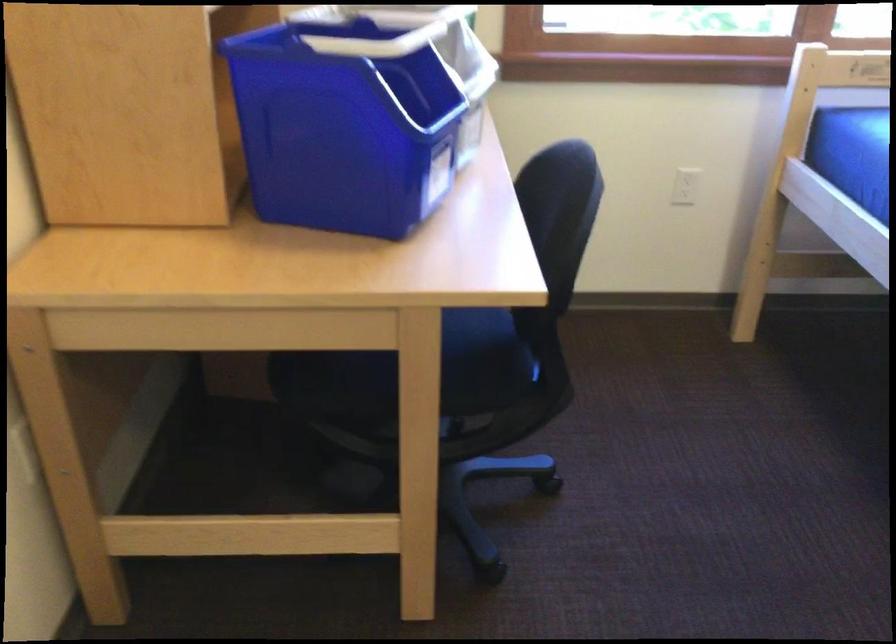
Find where to sit the black chair sitting surface. Please return your answer as a coordinate pair (x, y).

(409, 384)